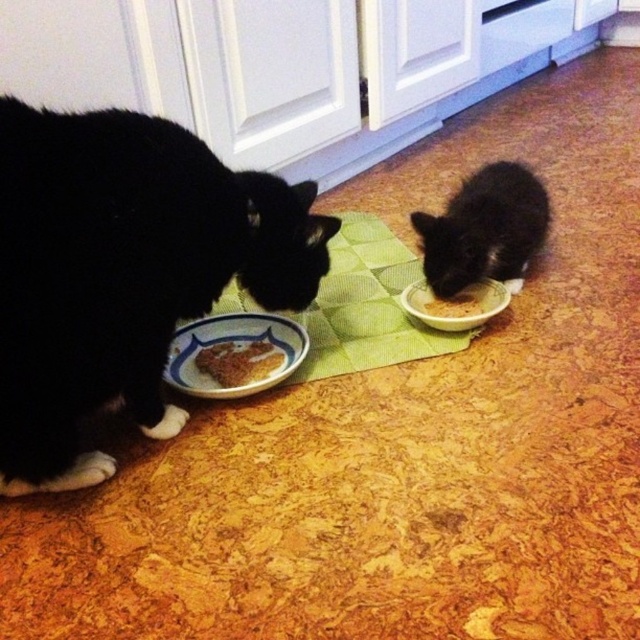
Is black glossy cat at left above brown matte bowl at center?

Yes, black glossy cat at left is above brown matte bowl at center.

Which of these two, black glossy cat at left or brown matte bowl at center, stands taller?

With more height is black glossy cat at left.

Is point (38, 113) behind point (472, 307)?

No, it is in front of (472, 307).

Identify the location of black glossy cat at left. The height and width of the screenshot is (640, 640). (122, 273).

Based on the photo, does green fabric mat at center have a lesser height compared to brown crumbly food at lower left?

In fact, green fabric mat at center may be taller than brown crumbly food at lower left.

Who is more forward, (250, 298) or (269, 355)?

Point (269, 355) is in front.

The image size is (640, 640). I want to click on green fabric mat at center, so click(364, 307).

Is black matte fur cat at lower right to the left of brown matte bowl at center from the viewer's perspective?

Incorrect, black matte fur cat at lower right is not on the left side of brown matte bowl at center.

Who is lower down, black matte fur cat at lower right or brown matte bowl at center?

brown matte bowl at center is lower down.

Which is behind, point (500, 198) or point (452, 321)?

The point (500, 198) is more distant.

Image resolution: width=640 pixels, height=640 pixels. What are the coordinates of `black matte fur cat at lower right` in the screenshot? It's located at (484, 228).